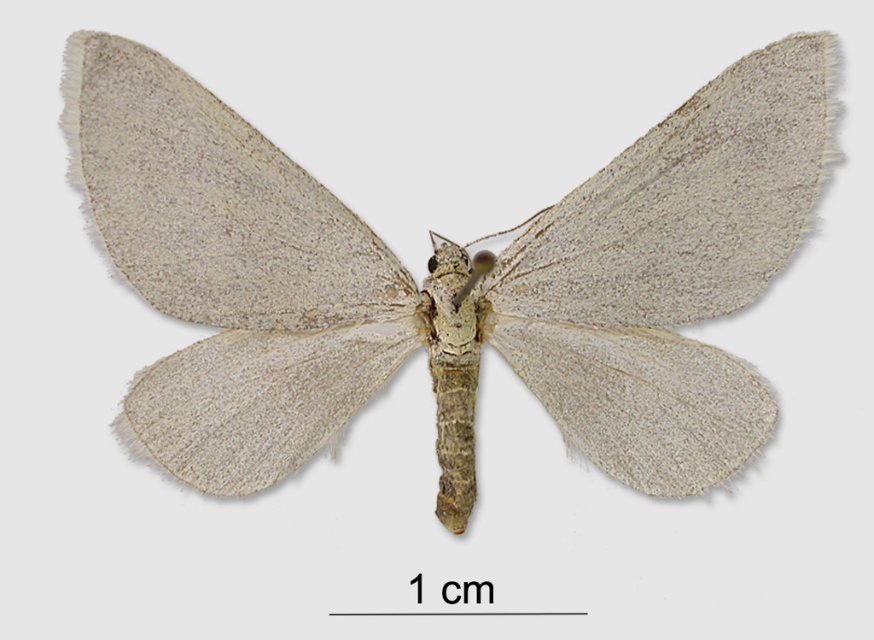
Question: Is fuzzy beige moth at center positioned before fuzzy white wing at center?

Choices:
 (A) yes
 (B) no

Answer: (B)

Question: Is fuzzy beige moth at center in front of fuzzy white wing at center?

Choices:
 (A) no
 (B) yes

Answer: (A)

Question: Which point is closer to the camera taking this photo?

Choices:
 (A) (310, 381)
 (B) (126, 154)
 (C) (680, 232)

Answer: (B)

Question: Which point is closer to the camera?

Choices:
 (A) fuzzy white wing at center
 (B) fuzzy beige moth at center

Answer: (A)

Question: From the image, what is the correct spatial relationship of fuzzy beige moth at center in relation to fuzzy gray wing at upper left?

Choices:
 (A) right
 (B) left

Answer: (A)

Question: Which point appears closest to the camera in this image?

Choices:
 (A) (184, 136)
 (B) (621, 208)
 (C) (136, 188)

Answer: (A)